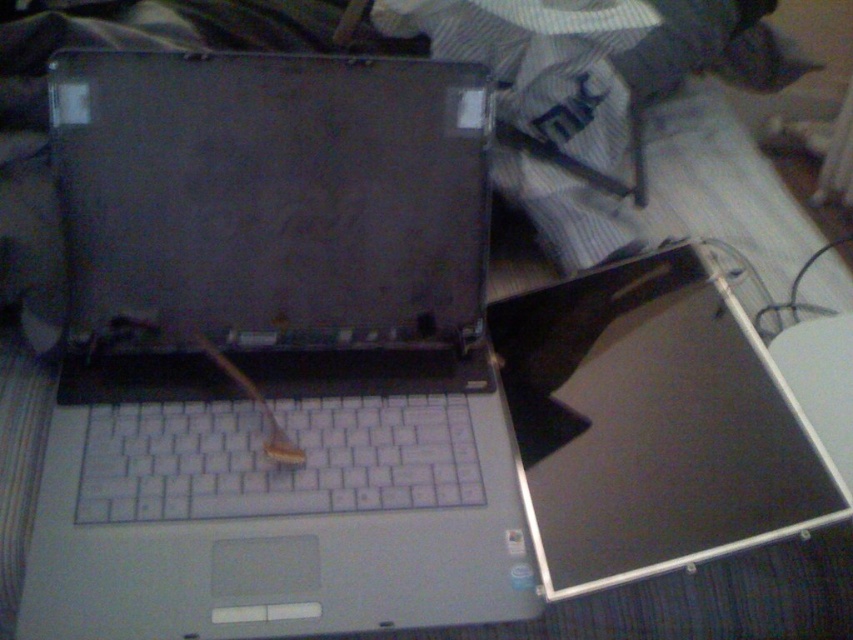
Question: Among these points, which one is farthest from the camera?

Choices:
 (A) (520, 404)
 (B) (260, 515)

Answer: (A)

Question: Among these objects, which one is farthest from the camera?

Choices:
 (A) satin black screen at center
 (B) satin silver laptop at center

Answer: (A)

Question: Is satin silver laptop at center to the right of satin black screen at center from the viewer's perspective?

Choices:
 (A) no
 (B) yes

Answer: (A)

Question: Which object is closer to the camera taking this photo?

Choices:
 (A) satin silver laptop at center
 (B) satin black screen at center

Answer: (A)

Question: Is satin silver laptop at center below satin black screen at center?

Choices:
 (A) no
 (B) yes

Answer: (A)

Question: Does satin silver laptop at center appear over satin black screen at center?

Choices:
 (A) yes
 (B) no

Answer: (A)